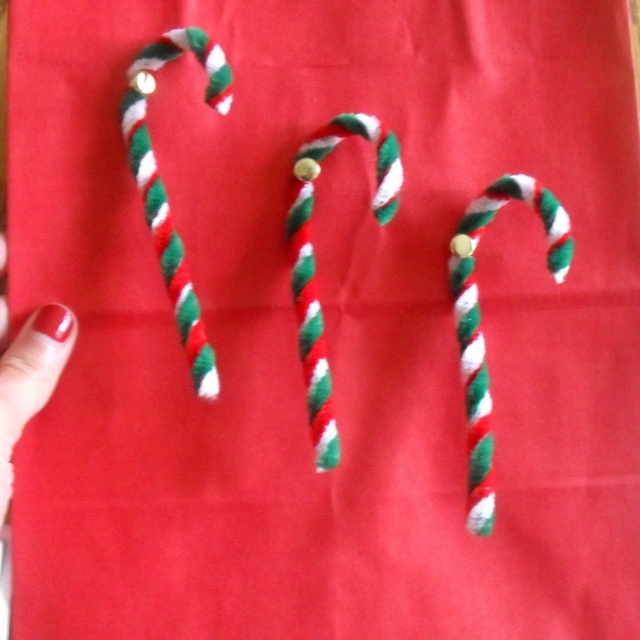
Can you confirm if twisted fabric candy cane at right is positioned to the right of twisted matte candy cane at center?

Indeed, twisted fabric candy cane at right is positioned on the right side of twisted matte candy cane at center.

Is twisted fabric candy cane at right closer to the viewer compared to twisted matte candy cane at center?

Yes.

Is point (504, 182) positioned after point (314, 378)?

No, it is in front of (314, 378).

Find the location of `twisted fabric candy cane at right`. twisted fabric candy cane at right is located at coordinates (480, 321).

Looking at this image, is twisted woolen candy cane at left closer to camera compared to twisted matte candy cane at center?

That is True.

Does twisted woolen candy cane at left appear on the right side of twisted matte candy cane at center?

Incorrect, twisted woolen candy cane at left is not on the right side of twisted matte candy cane at center.

The height and width of the screenshot is (640, 640). In order to click on twisted woolen candy cane at left in this screenshot , I will do [x=164, y=188].

Which is more to the left, twisted fabric candy cane at right or twisted woolen candy cane at left?

twisted woolen candy cane at left is more to the left.

Who is taller, twisted fabric candy cane at right or twisted woolen candy cane at left?

twisted woolen candy cane at left is taller.

Which is behind, point (564, 227) or point (208, 83)?

Point (208, 83)

In order to click on twisted fabric candy cane at right in this screenshot , I will do (480, 321).